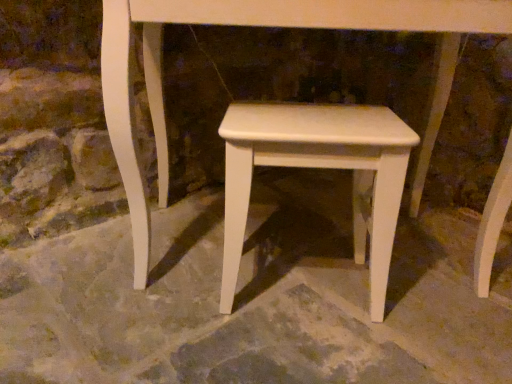
At what (x,y) coordinates should I click in order to perform the action: click on free point below white matte stool at center (from a real-world perspective). Please return your answer as a coordinate pair (x, y). This screenshot has height=384, width=512. Looking at the image, I should click on (295, 289).